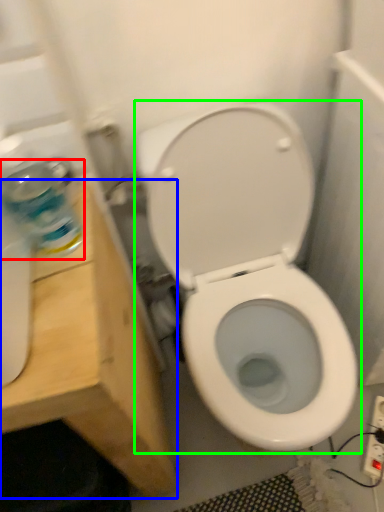
Question: Which object is the farthest from cleaning product (highlighted by a red box)? Choose among these: vanity (highlighted by a blue box) or toilet (highlighted by a green box).

Choices:
 (A) vanity
 (B) toilet

Answer: (B)